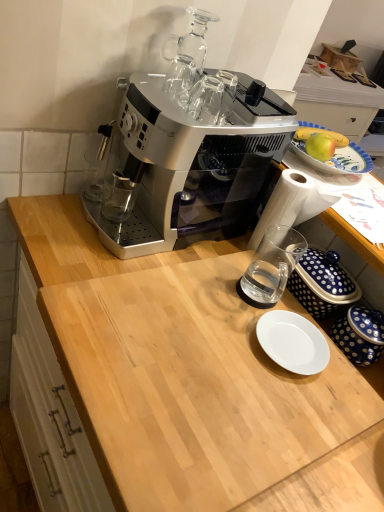
Where is `free spot behind white glossy plate at center`? The width and height of the screenshot is (384, 512). free spot behind white glossy plate at center is located at coordinates (287, 293).